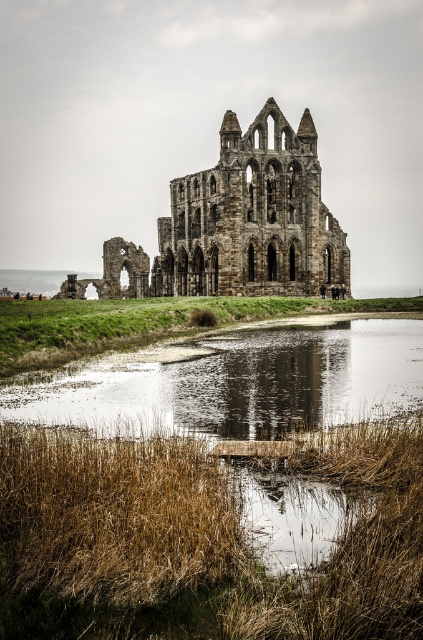
You are a photographer planning to capture the stone gothic ruins at center and the brown dry reed at lower left in a single frame. Based on their sizes, which object should you focus on first to ensure both are in focus?

The stone gothic ruins at center are larger than the brown dry reed at lower left. To ensure both are in focus, you should focus on the stone gothic ruins at center first since larger objects generally require focusing on the main subject to maintain sharpness across the frame.